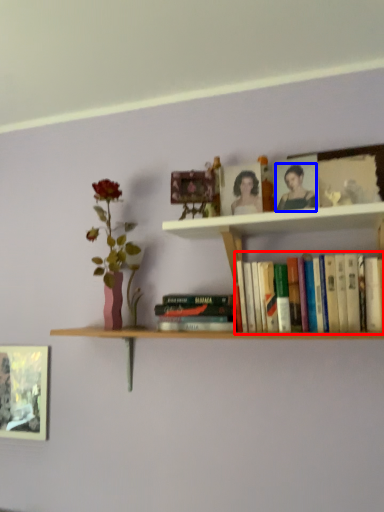
Question: Among these objects, which one is farthest to the camera, book (highlighted by a red box) or person (highlighted by a blue box)?

Choices:
 (A) book
 (B) person

Answer: (B)